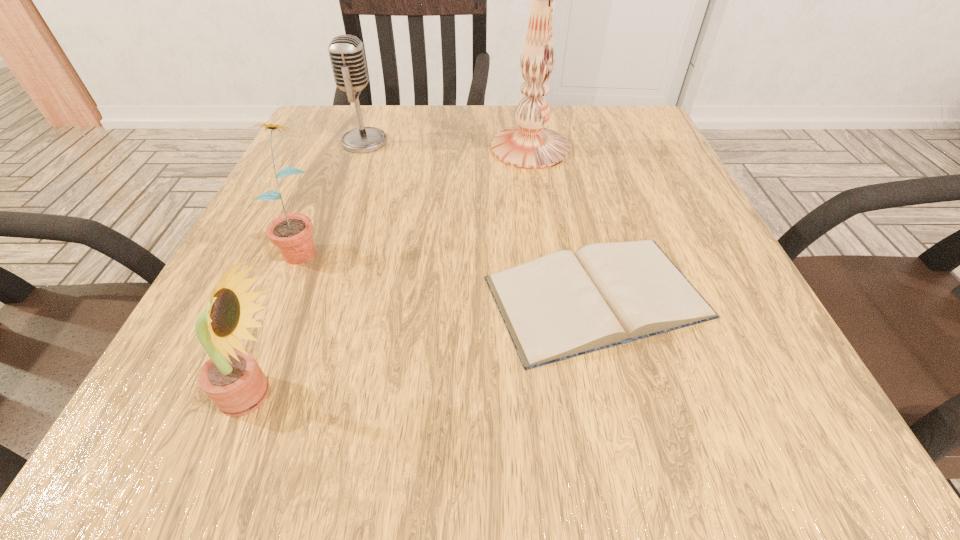
At what (x,y) coordinates should I click in order to perform the action: click on vacant space at the near edge of the desktop. Please return your answer as a coordinate pair (x, y). The height and width of the screenshot is (540, 960). Looking at the image, I should click on (362, 429).

In the image, there is a desktop. Identify the location of free space at the left edge. (306, 166).

Identify the location of vacant position at the right edge of the desktop. The image size is (960, 540). (678, 218).

Identify the location of vacant space at the far left corner of the desktop. (301, 150).

The height and width of the screenshot is (540, 960). In order to click on free location at the near left corner in this screenshot , I will do `click(173, 449)`.

At what (x,y) coordinates should I click in order to perform the action: click on vacant area at the far right corner. Please return your answer as a coordinate pair (x, y). The image size is (960, 540). Looking at the image, I should click on (660, 145).

At what (x,y) coordinates should I click in order to perform the action: click on empty location between the tallest object and the nearer sunflower. Please return your answer as a coordinate pair (x, y). This screenshot has width=960, height=540. Looking at the image, I should click on (393, 271).

I want to click on free space between the nearer sunflower and the tallest object, so click(393, 271).

At what (x,y) coordinates should I click in order to perform the action: click on free space between the Bible and the microphone. Please return your answer as a coordinate pair (x, y). Looking at the image, I should click on (481, 219).

In order to click on vacant area between the farther sunflower and the lamp in this screenshot , I will do `click(416, 197)`.